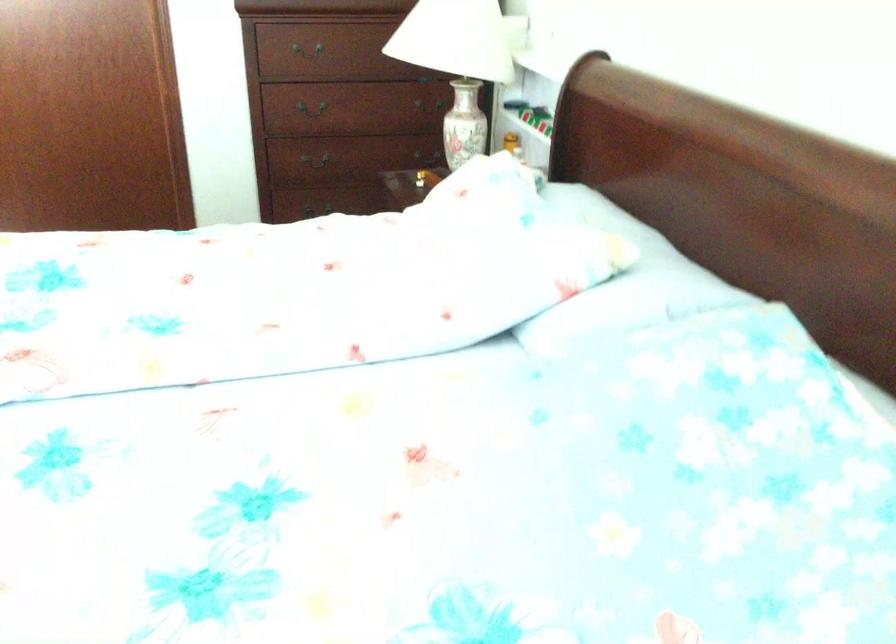
At what (x,y) coordinates should I click in order to perform the action: click on ceramic flower vase. Please return your answer as a coordinate pair (x, y). This screenshot has height=644, width=896. Looking at the image, I should click on (463, 124).